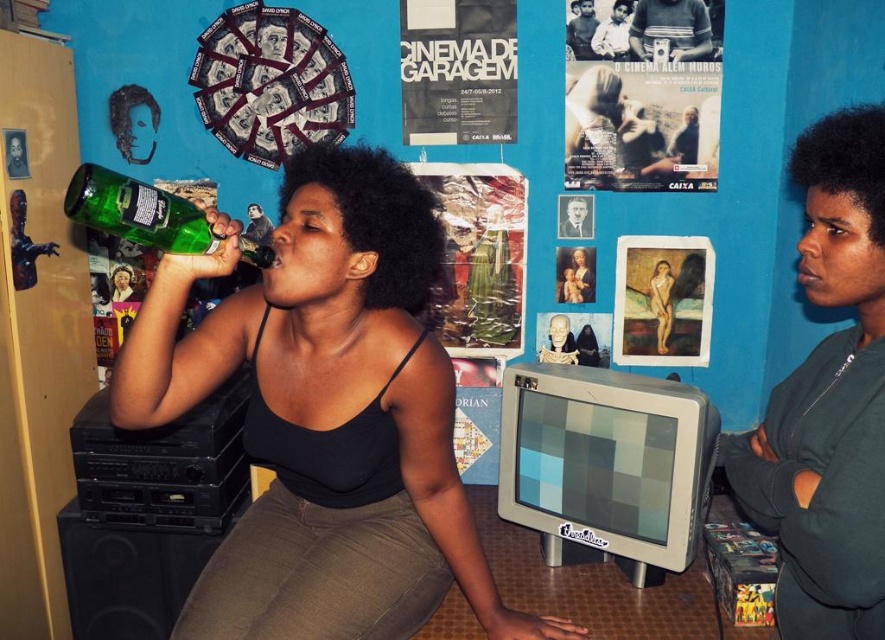
You are a painter who needs to place a 1.2 meter tall easel in the room. You see the light brown wooden chair at upper center and the matte black tank top at center. Which object is taller and can the easel fit between them vertically?

The light brown wooden chair at upper center is taller than the matte black tank top at center. Since the easel is 1.2 meters tall, it can fit vertically between them as long as there is enough space between the two objects.

You are an interior designer assessing the placement of items in the room. The smooth skin nude at center and the brown leather jacket at upper center are both part of the decor. Which object is closer to the viewer?

The smooth skin nude at center is closer to the viewer than the brown leather jacket at upper center.